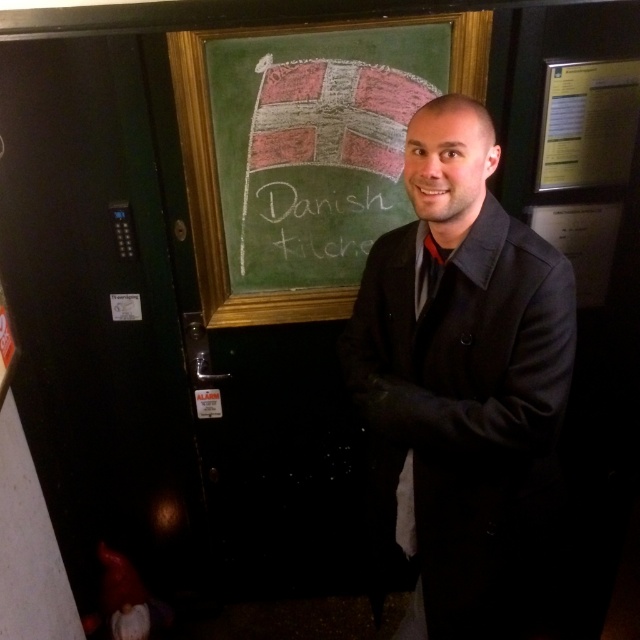
Can you confirm if green chalkboard at center is thinner than white chalk writing at center?

No.

Can you confirm if green chalkboard at center is positioned to the right of white chalk writing at center?

Correct, you'll find green chalkboard at center to the right of white chalk writing at center.

Which is in front, point (200, 100) or point (284, 250)?

Point (200, 100)

The image size is (640, 640). In order to click on green chalkboard at center in this screenshot , I will do (x=216, y=179).

Describe the element at coordinates (216, 179) in the screenshot. This screenshot has height=640, width=640. I see `green chalkboard at center` at that location.

Is green chalkboard at center thinner than black satin tie at center?

No.

Who is more forward, (328, 317) or (412, 484)?

Positioned in front is point (412, 484).

Where is `green chalkboard at center`? green chalkboard at center is located at coordinates (216, 179).

Which is in front, point (356, 381) or point (241, 243)?

Positioned in front is point (356, 381).

The image size is (640, 640). I want to click on dark gray wool coat at center, so click(x=460, y=380).